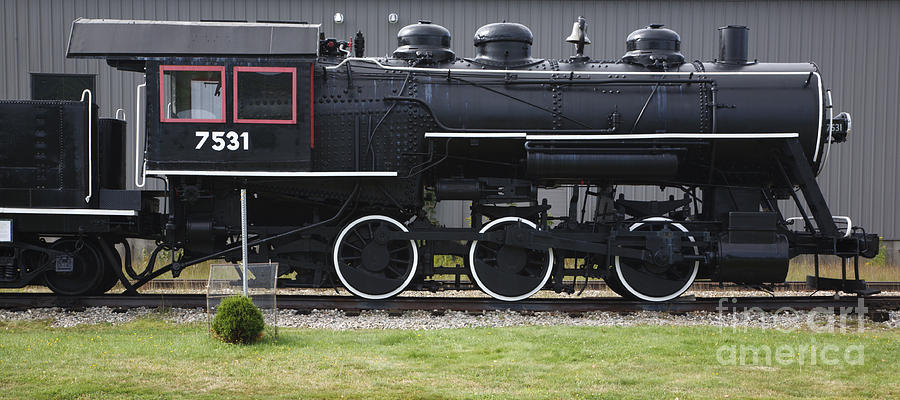
The height and width of the screenshot is (400, 900). I want to click on knob, so click(348, 43).